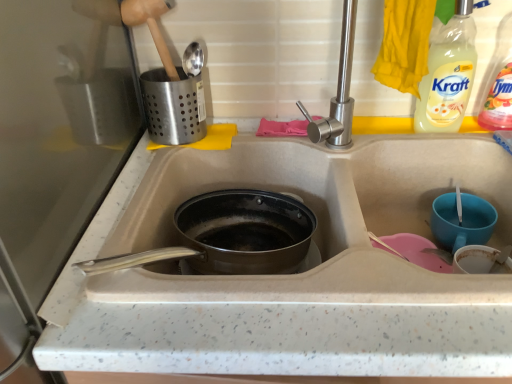
Question: Considering the relative sizes of clear plastic bottle at upper right, the first bottle positioned from the right, and matte gray sink at center in the image provided, is clear plastic bottle at upper right, the first bottle positioned from the right, thinner than matte gray sink at center?

Choices:
 (A) no
 (B) yes

Answer: (B)

Question: Is clear plastic bottle at upper right, the 2th bottle positioned from the left, to the right of matte gray sink at center from the viewer's perspective?

Choices:
 (A) yes
 (B) no

Answer: (A)

Question: Is clear plastic bottle at upper right, the first bottle positioned from the right, not near matte gray sink at center?

Choices:
 (A) no
 (B) yes

Answer: (A)

Question: Does clear plastic bottle at upper right, the 2th bottle positioned from the left, lie behind matte gray sink at center?

Choices:
 (A) no
 (B) yes

Answer: (B)

Question: Is clear plastic bottle at upper right, the 2th bottle positioned from the left, to the left of matte gray sink at center from the viewer's perspective?

Choices:
 (A) no
 (B) yes

Answer: (A)

Question: Is clear plastic bottle at upper right, the 2th bottle positioned from the left, bigger than matte gray sink at center?

Choices:
 (A) yes
 (B) no

Answer: (B)

Question: Considering the relative sizes of clear plastic bottle at upper right, the first bottle positioned from the right, and clear plastic bottle at upper right, the 1th bottle positioned from the left, in the image provided, is clear plastic bottle at upper right, the first bottle positioned from the right, smaller than clear plastic bottle at upper right, the 1th bottle positioned from the left,?

Choices:
 (A) no
 (B) yes

Answer: (A)

Question: Is clear plastic bottle at upper right, the first bottle positioned from the right, turned away from clear plastic bottle at upper right, the 1th bottle positioned from the left?

Choices:
 (A) no
 (B) yes

Answer: (A)

Question: From a real-world perspective, is clear plastic bottle at upper right, the 2th bottle positioned from the left, located beneath clear plastic bottle at upper right, the 1th bottle positioned from the left?

Choices:
 (A) no
 (B) yes

Answer: (A)

Question: Considering the relative positions of clear plastic bottle at upper right, the first bottle positioned from the right, and clear plastic bottle at upper right, acting as the second bottle starting from the right, in the image provided, is clear plastic bottle at upper right, the first bottle positioned from the right, to the left of clear plastic bottle at upper right, acting as the second bottle starting from the right, from the viewer's perspective?

Choices:
 (A) yes
 (B) no

Answer: (B)

Question: Does clear plastic bottle at upper right, the first bottle positioned from the right, have a larger size compared to clear plastic bottle at upper right, acting as the second bottle starting from the right?

Choices:
 (A) yes
 (B) no

Answer: (A)

Question: Is clear plastic bottle at upper right, the first bottle positioned from the right, placed right next to clear plastic bottle at upper right, the 1th bottle positioned from the left?

Choices:
 (A) yes
 (B) no

Answer: (A)

Question: From a real-world perspective, is matte gray sink at center on wooden shovel at upper left?

Choices:
 (A) no
 (B) yes

Answer: (A)